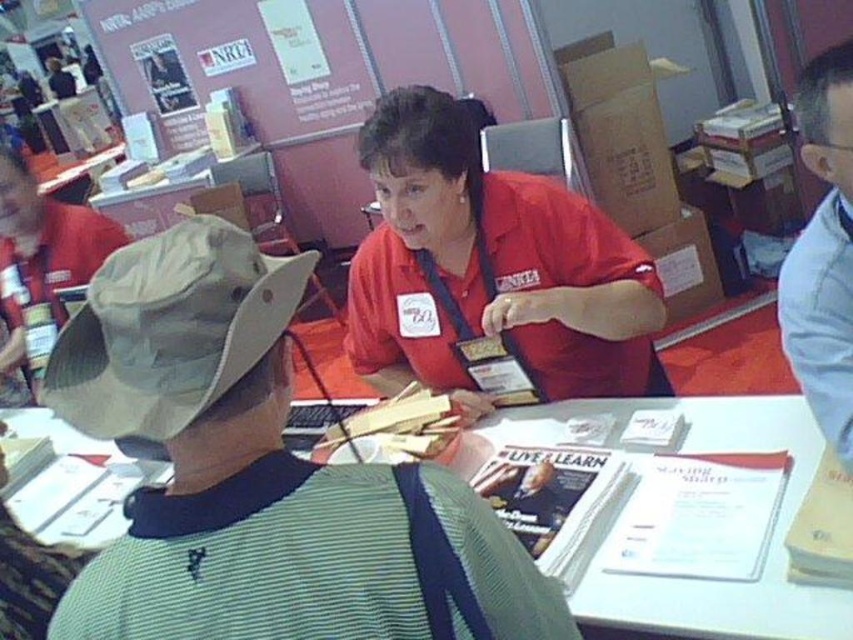
You are a visitor at the convention and want to approach the booth. You notice the matte red shirt at center and the khaki fabric hat at upper left. Which object is closer to you as you approach the booth?

The khaki fabric hat at upper left is closer to you because the matte red shirt at center is 1.52 meters away from it, meaning the hat is nearer in proximity.